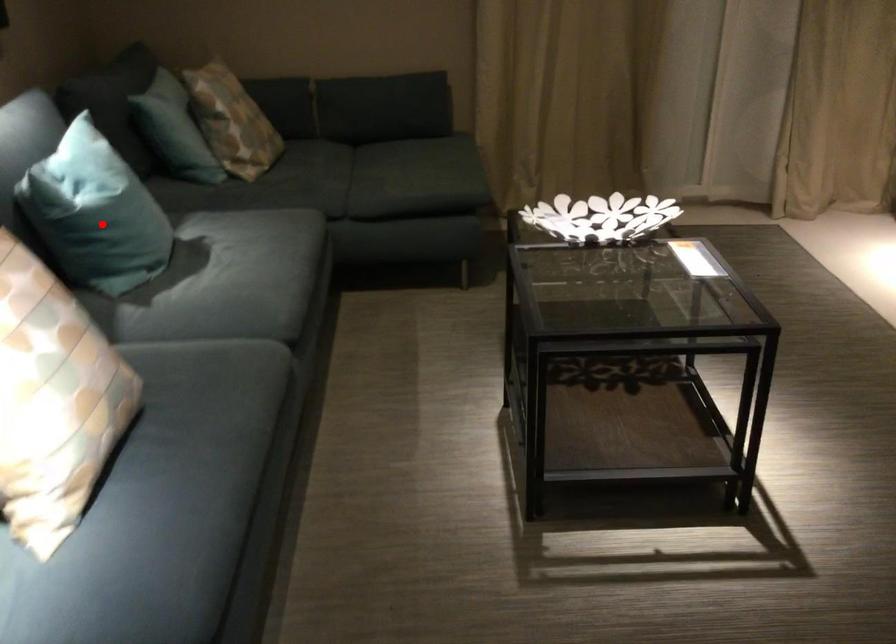
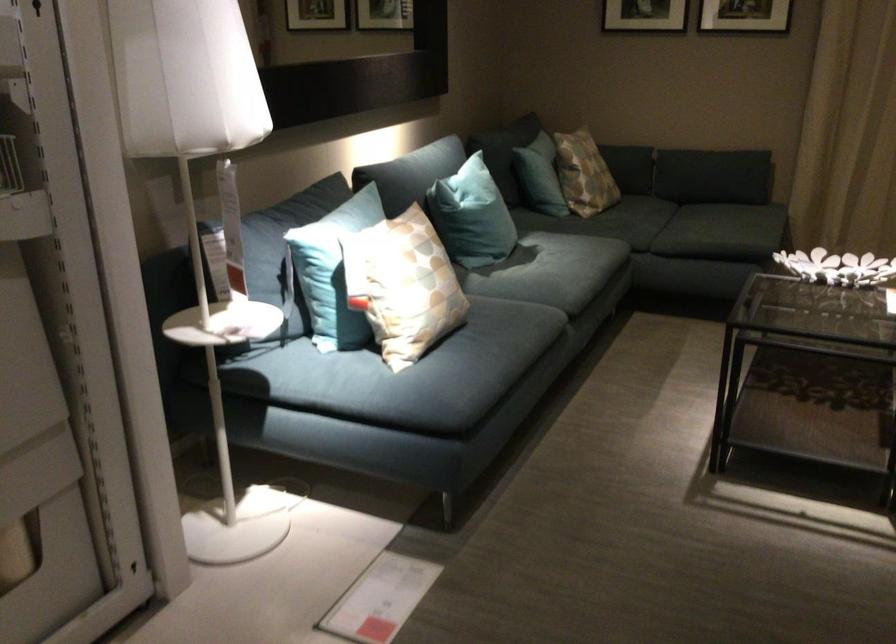
Question: I am providing you with two images of the same scene from different viewpoints. A red point is marked on the first image. Can you still see the location of the red point in image 2?

Choices:
 (A) Yes
 (B) No

Answer: (A)